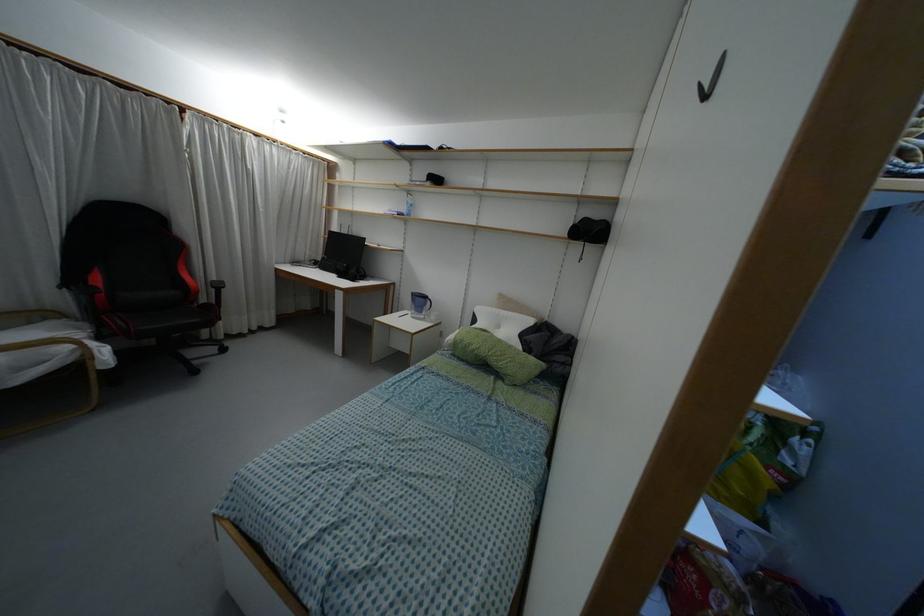
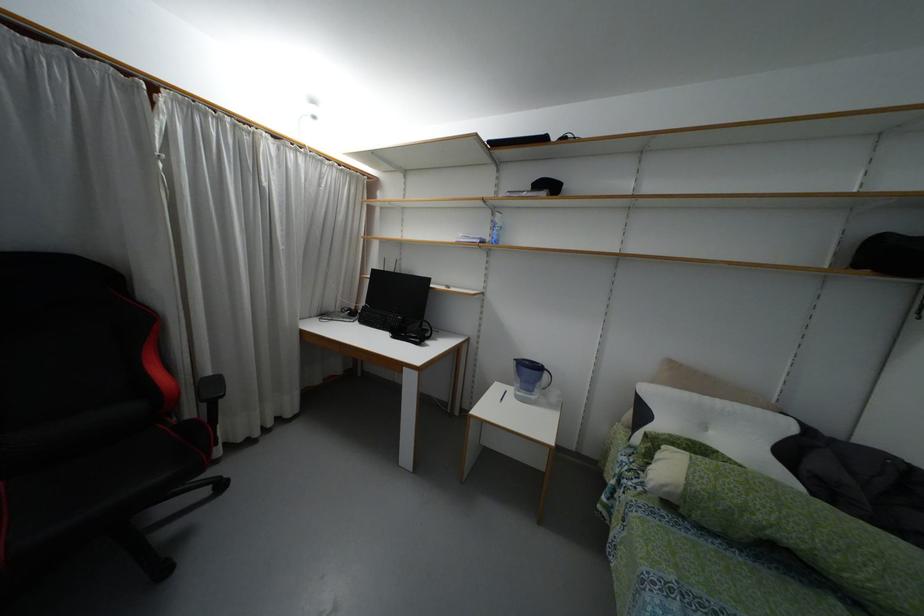
In the second image, find the point that corresponds to point (496, 310) in the first image.

(695, 395)